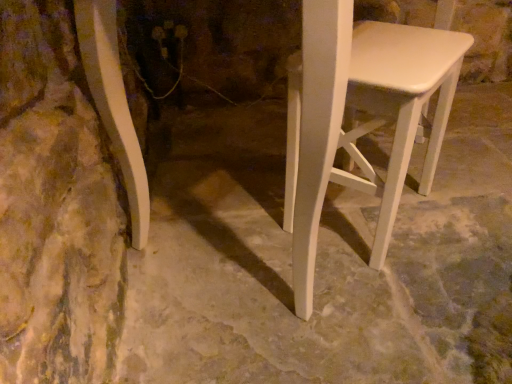
The width and height of the screenshot is (512, 384). In order to click on vacant space underneath white matte stool at right (from a real-world perspective) in this screenshot , I will do `click(358, 218)`.